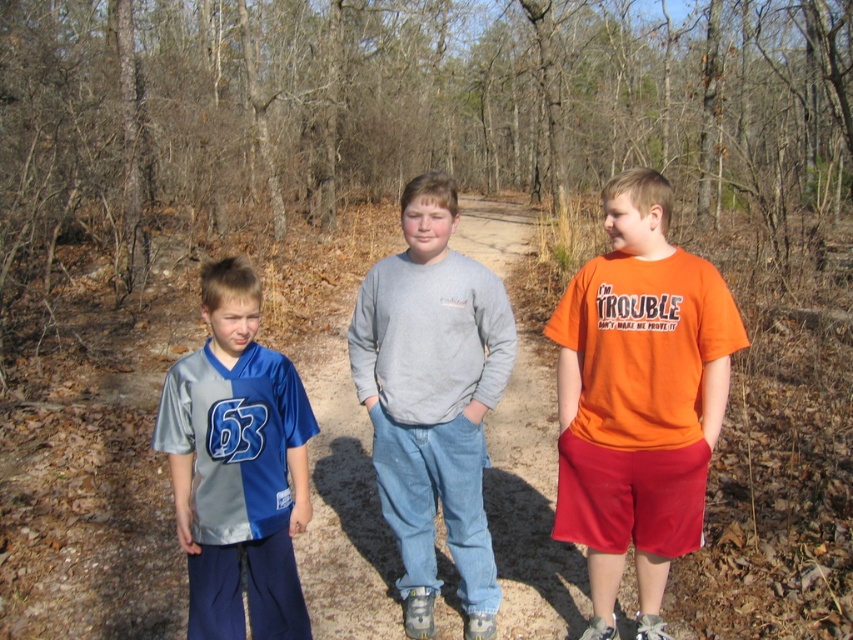
You are a photographer standing on the dirt path and want to take a photo of the gray cotton sweatshirt at center and the shiny jersey at center. Which one is higher in the frame?

The gray cotton sweatshirt at center is located above the shiny jersey at center, so it is higher in the frame.

You are a photographer trying to capture a candid shot of the middle boy. You notice the shiny jersey at center and gray cotton sweatshirt at center. Which clothing item is blocking your view of the middle boy?

The shiny jersey at center is behind gray cotton sweatshirt at center, so the gray cotton sweatshirt at center is blocking the view of the middle boy.

You are standing at the origin of a coordinate system placed at the bottom left corner of the image. The middle boy is located at point (x=637, y=397). You want to walk to the orange cotton t shirt at right. Which direction should you go?

The point (x=637, y=397) marks the orange cotton t shirt at right, so you are already at the desired location.